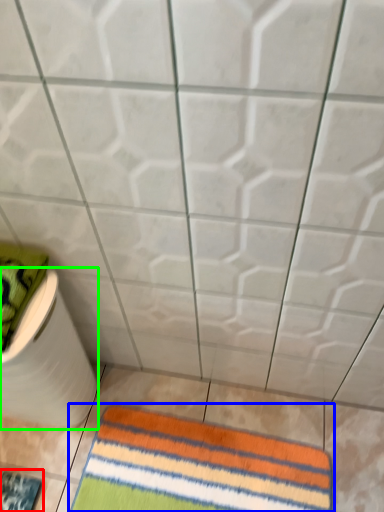
Question: Which is farther away from mat (highlighted by a red box)? towel (highlighted by a blue box) or toilet paper (highlighted by a green box)?

Choices:
 (A) towel
 (B) toilet paper

Answer: (A)